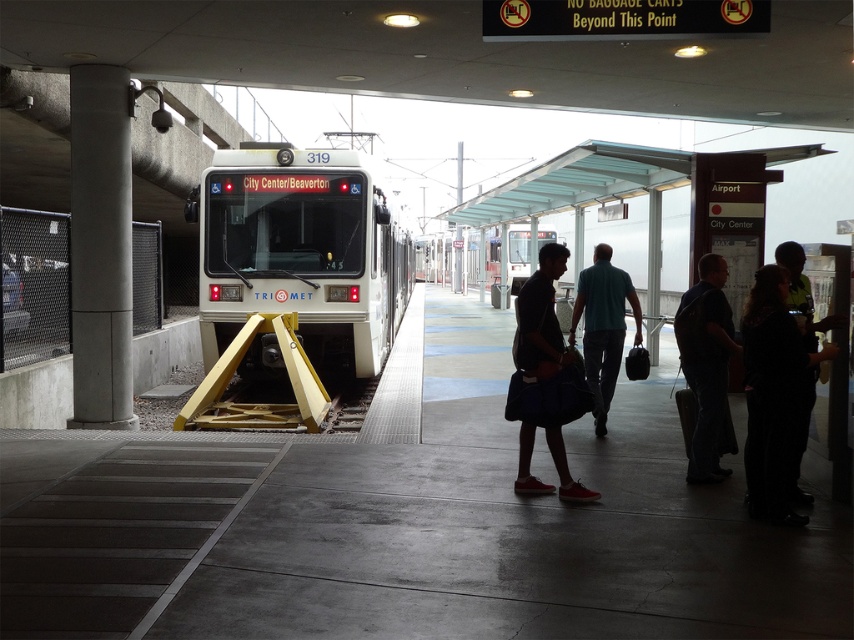
You are standing on the train station platform and want to reach the point marked as point (360,196). If you can walk at a speed of 1.5 meters per second, how many seconds will it take you to reach that point?

The distance between you and point (360,196) is 11.12 meters. At a walking speed of 1.5 meters per second, it would take approximately 7.41 seconds to reach the point.

You are standing on the train platform and want to take a photo of both point (x=209, y=177) and point (x=586, y=288) in the same frame. Which point should you focus on first to ensure both are in focus?

You should focus on point (x=209, y=177) first because it is closer to the camera than point (x=586, y=288). This ensures the closer point is in focus, and the farther point will also be in focus due to depth of field.

You are a delivery robot with a package that needs to be placed between the dark blue fabric bag at center and the dark blue jeans at center. The robot requires at least 1 meter of space to maneuver. Can you safely place the package between them?

The dark blue fabric bag at center and dark blue jeans at center are 1.23 meters apart from each other. Since the required space is 1 meter, the robot can safely maneuver and place the package between them as the distance is sufficient.